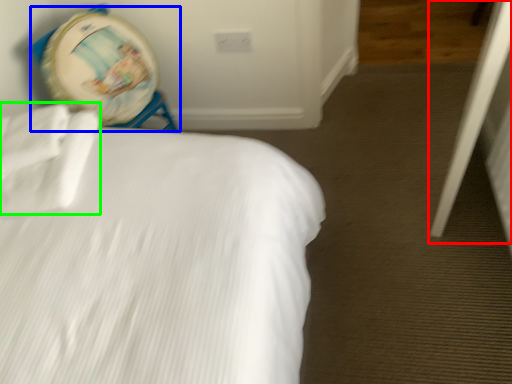
Question: Which is nearer to the screen door (highlighted by a red box)? swivel chair (highlighted by a blue box) or sheet (highlighted by a green box).

Choices:
 (A) swivel chair
 (B) sheet

Answer: (B)